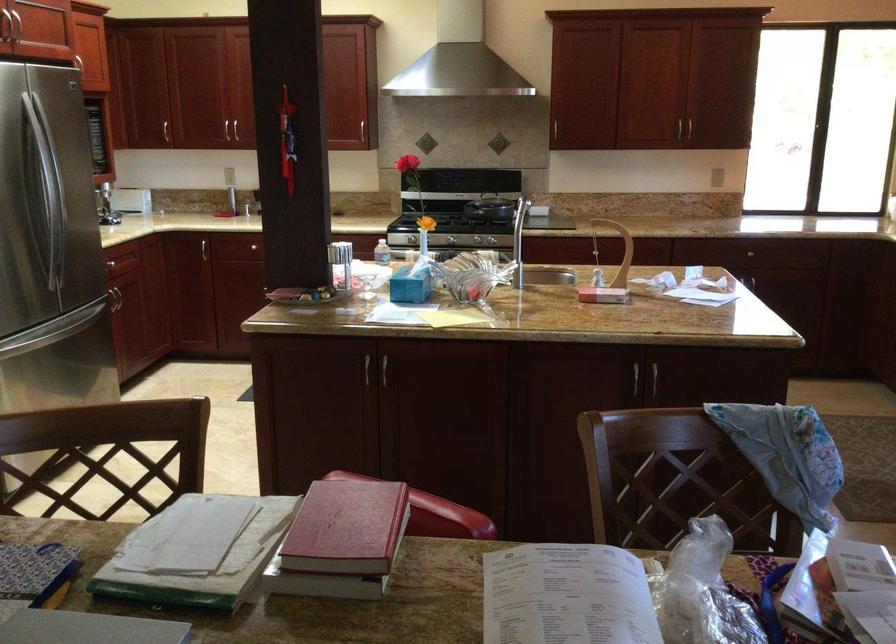
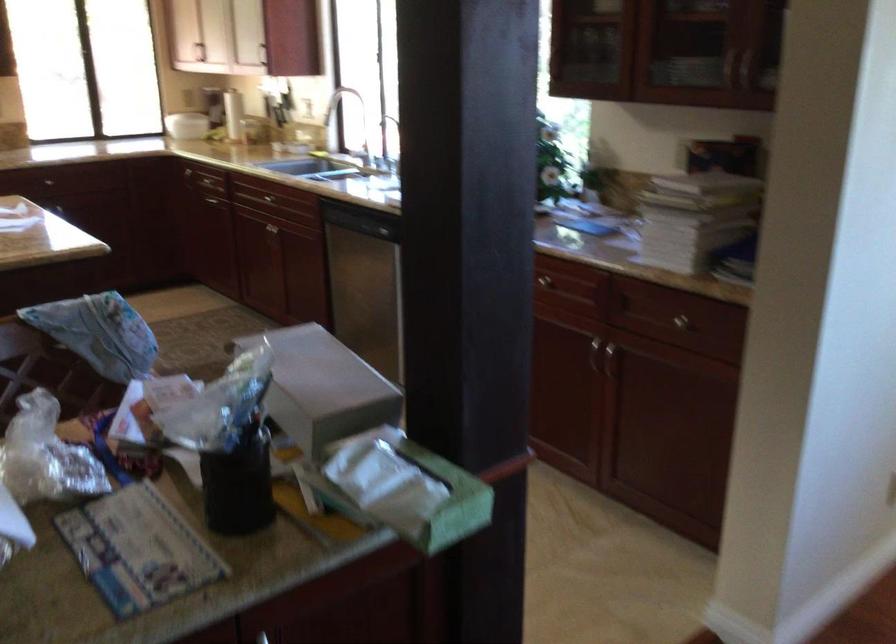
In the second image, find the point that corresponds to (x=712, y=263) in the first image.

(65, 207)